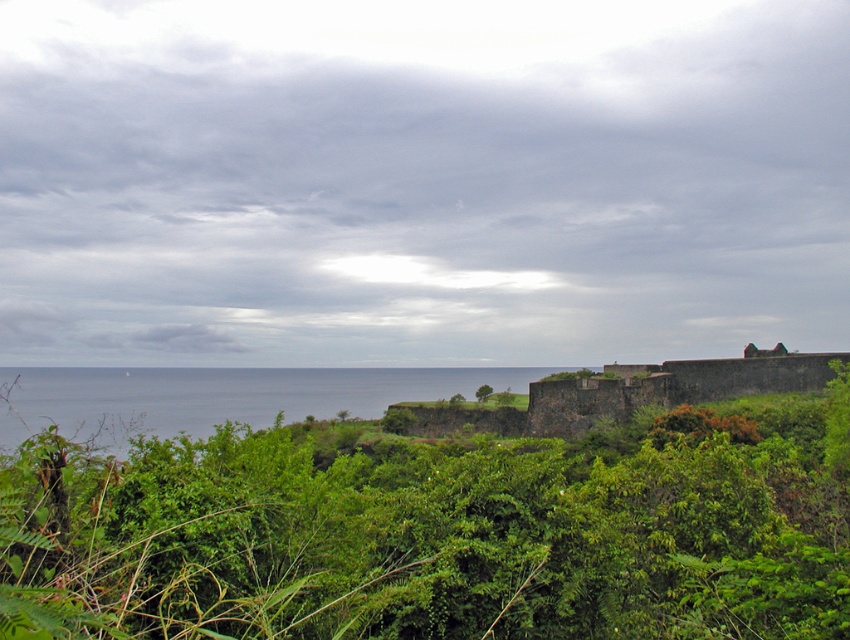
Based on the photo, you are standing at the point with coordinates 0.5, 0.5 in the image. Which direction should you move to reach the green leafy shrubs at center?

The green leafy shrubs at center are located at point (442, 528), so you should move northeast to reach them.

You are standing in the coastal landscape and want to walk from the stone wall to the blue water at center. Which direction should you head relative to the green leafy tree at center?

You should head to the left of the green leafy tree at center because the blue water at center is located to the left of it.